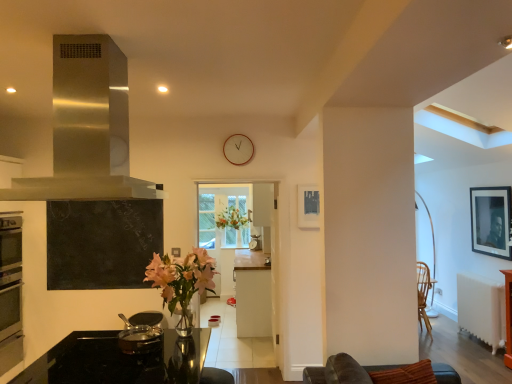
Question: From a real-world perspective, is stainless steel exhaust hood at upper left below shiny metallic pot at lower left?

Choices:
 (A) yes
 (B) no

Answer: (B)

Question: Can you confirm if stainless steel exhaust hood at upper left is positioned to the left of shiny metallic pot at lower left?

Choices:
 (A) yes
 (B) no

Answer: (A)

Question: From a real-world perspective, is stainless steel exhaust hood at upper left physically above shiny metallic pot at lower left?

Choices:
 (A) no
 (B) yes

Answer: (B)

Question: Would you say stainless steel exhaust hood at upper left is outside shiny metallic pot at lower left?

Choices:
 (A) yes
 (B) no

Answer: (A)

Question: Does stainless steel exhaust hood at upper left have a smaller size compared to shiny metallic pot at lower left?

Choices:
 (A) yes
 (B) no

Answer: (B)

Question: Is stainless steel exhaust hood at upper left spatially inside black matte picture frame at upper right, the 1th picture frame in the back-to-front sequence, or outside of it?

Choices:
 (A) inside
 (B) outside

Answer: (B)

Question: From their relative heights in the image, would you say stainless steel exhaust hood at upper left is taller or shorter than black matte picture frame at upper right, which is the second picture frame from front to back?

Choices:
 (A) short
 (B) tall

Answer: (A)

Question: Does point (12, 182) appear closer or farther from the camera than point (472, 228)?

Choices:
 (A) farther
 (B) closer

Answer: (B)

Question: Considering the relative positions of stainless steel exhaust hood at upper left and black matte picture frame at upper right, the 1th picture frame in the back-to-front sequence, in the image provided, is stainless steel exhaust hood at upper left to the left or to the right of black matte picture frame at upper right, the 1th picture frame in the back-to-front sequence,?

Choices:
 (A) left
 (B) right

Answer: (A)

Question: Is brown leather couch at lower right in front of or behind wooden clock at center in the image?

Choices:
 (A) front
 (B) behind

Answer: (A)

Question: Would you say brown leather couch at lower right is to the left or to the right of wooden clock at center in the picture?

Choices:
 (A) left
 (B) right

Answer: (B)

Question: Looking at the image, does brown leather couch at lower right seem bigger or smaller compared to wooden clock at center?

Choices:
 (A) small
 (B) big

Answer: (B)

Question: Looking at their shapes, would you say brown leather couch at lower right is wider or thinner than wooden clock at center?

Choices:
 (A) wide
 (B) thin

Answer: (A)

Question: Does point (126, 345) appear closer or farther from the camera than point (258, 311)?

Choices:
 (A) farther
 (B) closer

Answer: (B)

Question: From the image's perspective, is shiny metallic pot at lower left located above or below white matte cabinet at center?

Choices:
 (A) below
 (B) above

Answer: (B)